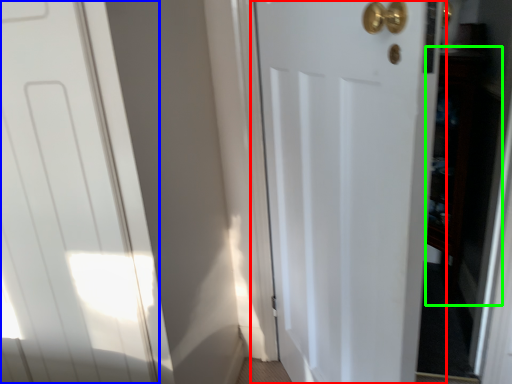
Question: Which object is positioned farthest from door (highlighted by a red box)? Select from door (highlighted by a blue box) and cabinetry (highlighted by a green box).

Choices:
 (A) door
 (B) cabinetry

Answer: (B)